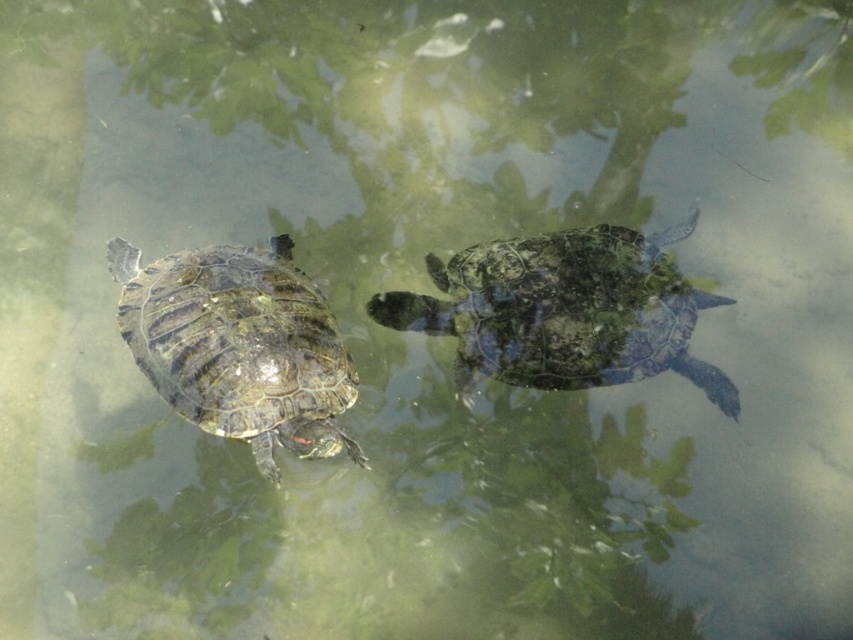
You are a photographer standing at the edge of the pond, and you want to take a clear photo of the turtle at point (437, 316). The pond is 5 feet deep. Can you reach the turtle with your camera lens if the minimum focusing distance is 5 feet?

The distance between you and the turtle at point (437, 316) is 5.35 feet, which is slightly more than the minimum focusing distance of 5 feet. Therefore, you can focus on the turtle as your camera can capture objects beyond the minimum distance.